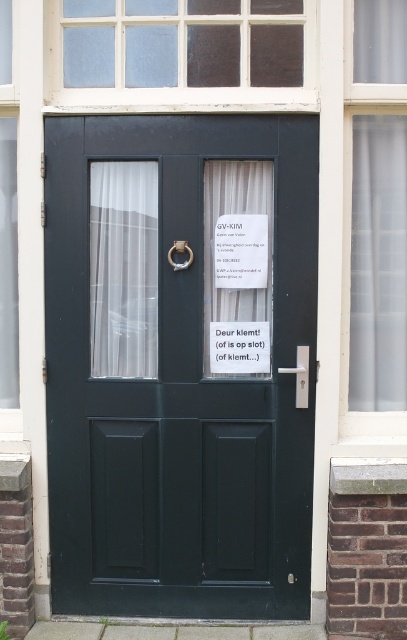
Question: Is clear glass window at upper center positioned at the back of white paper at center?

Choices:
 (A) no
 (B) yes

Answer: (A)

Question: Which point is closer to the camera?

Choices:
 (A) white paper at center
 (B) translucent glass window at center

Answer: (B)

Question: Which of the following is the farthest from the observer?

Choices:
 (A) clear glass window at upper center
 (B) matte dark green door at center
 (C) translucent glass window at center

Answer: (A)

Question: Is matte dark green door at center smaller than white sheer curtain at left?

Choices:
 (A) yes
 (B) no

Answer: (B)

Question: Can you confirm if translucent glass window at center is positioned below clear glass window at upper center?

Choices:
 (A) no
 (B) yes

Answer: (B)

Question: Which of the following is the closest to the observer?

Choices:
 (A) white sheer curtain at left
 (B) clear glass window at upper center

Answer: (B)